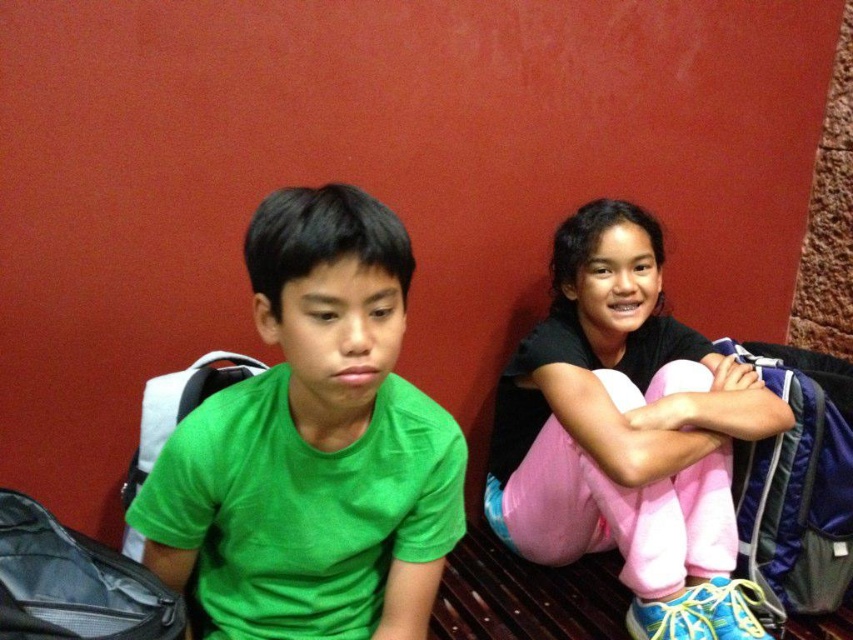
Which is more to the left, green matte shirt at center or pink fleece pants at center?

green matte shirt at center is more to the left.

Is green matte shirt at center smaller than pink fleece pants at center?

Yes, green matte shirt at center is smaller than pink fleece pants at center.

The height and width of the screenshot is (640, 853). Identify the location of green matte shirt at center. (312, 445).

You are a GUI agent. You are given a task and a screenshot of the screen. Output one action in this format:
    pyautogui.click(x=<x>, y=<y>)
    Task: Click on the green matte shirt at center
    
    Given the screenshot: What is the action you would take?
    pyautogui.click(x=312, y=445)